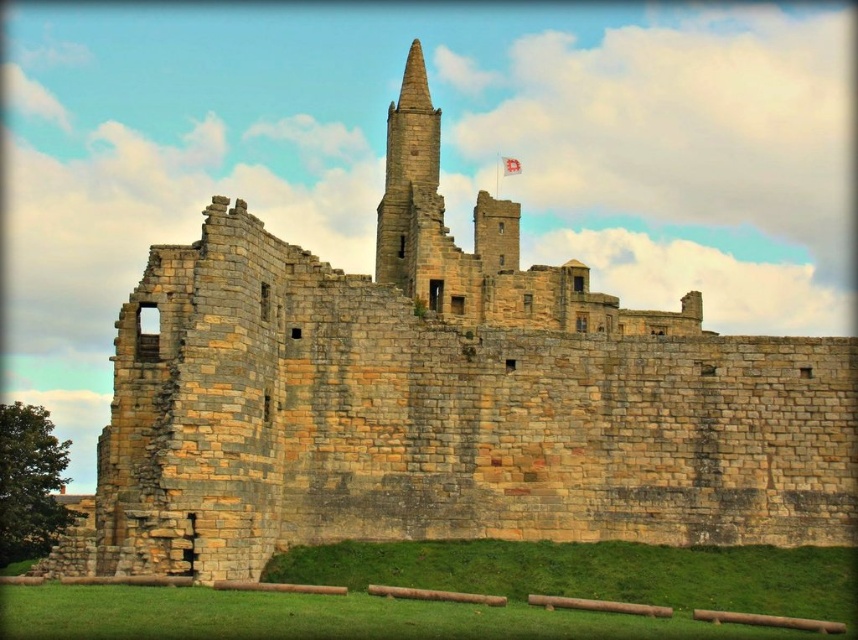
Question: Which point is closer to the camera?

Choices:
 (A) (414, 122)
 (B) (509, 170)

Answer: (A)

Question: Where is stone spire at center located in relation to white fabric flag at upper center in the image?

Choices:
 (A) right
 (B) left

Answer: (B)

Question: Can you confirm if stone spire at center is positioned above white fabric flag at upper center?

Choices:
 (A) no
 (B) yes

Answer: (A)

Question: Which of the following is the farthest from the observer?

Choices:
 (A) (520, 172)
 (B) (408, 61)

Answer: (A)

Question: Can you confirm if stone spire at center is wider than white fabric flag at upper center?

Choices:
 (A) yes
 (B) no

Answer: (A)